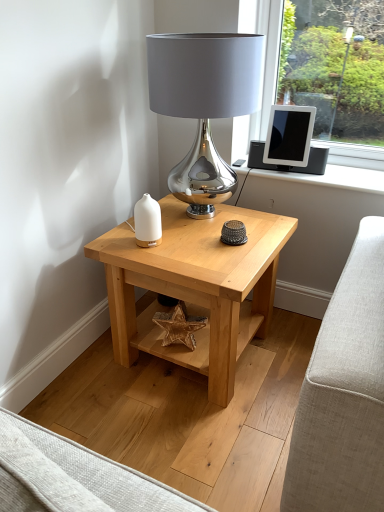
Question: Is satin silver lamp at center turned away from white matte vase at center?

Choices:
 (A) no
 (B) yes

Answer: (A)

Question: Considering the relative sizes of satin silver lamp at center and white matte vase at center in the image provided, is satin silver lamp at center shorter than white matte vase at center?

Choices:
 (A) yes
 (B) no

Answer: (B)

Question: Is satin silver lamp at center not within white matte vase at center?

Choices:
 (A) yes
 (B) no

Answer: (A)

Question: Is satin silver lamp at center with white matte vase at center?

Choices:
 (A) yes
 (B) no

Answer: (B)

Question: Could white matte vase at center be considered to be inside satin silver lamp at center?

Choices:
 (A) yes
 (B) no

Answer: (B)

Question: Is satin silver lamp at center at the left side of white matte vase at center?

Choices:
 (A) yes
 (B) no

Answer: (B)

Question: Is white matte vase at center closer to the viewer compared to matte black tablet at upper right?

Choices:
 (A) yes
 (B) no

Answer: (A)

Question: From a real-world perspective, is white matte vase at center below matte black tablet at upper right?

Choices:
 (A) yes
 (B) no

Answer: (A)

Question: Does white matte vase at center have a lesser height compared to matte black tablet at upper right?

Choices:
 (A) no
 (B) yes

Answer: (B)

Question: Are white matte vase at center and matte black tablet at upper right far apart?

Choices:
 (A) yes
 (B) no

Answer: (B)

Question: From a real-world perspective, is white matte vase at center on matte black tablet at upper right?

Choices:
 (A) no
 (B) yes

Answer: (A)

Question: Is white matte vase at center wider than matte black tablet at upper right?

Choices:
 (A) yes
 (B) no

Answer: (B)

Question: Is satin silver lamp at center shorter than light wood table at center?

Choices:
 (A) yes
 (B) no

Answer: (B)